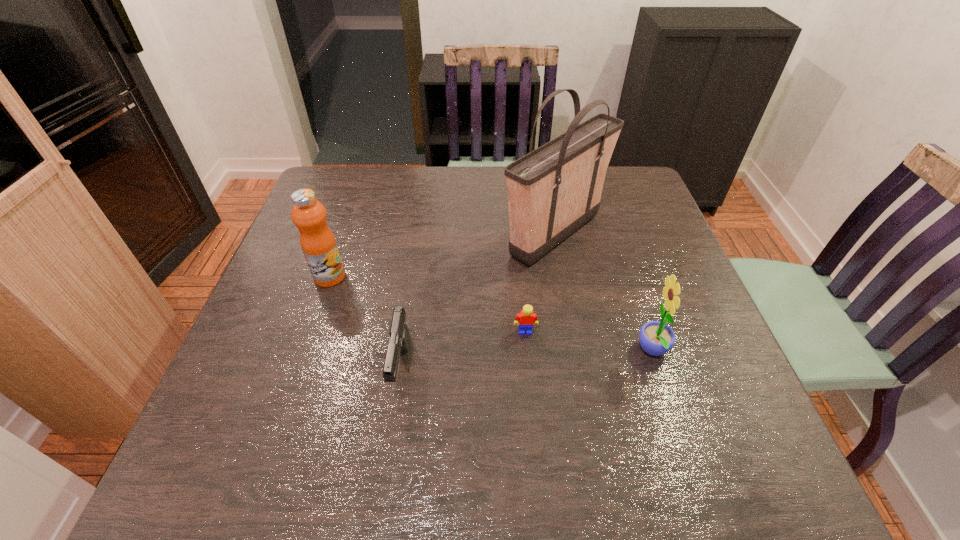
Find the location of `vacant space located on the front-facing side of the third tallest object`. vacant space located on the front-facing side of the third tallest object is located at coordinates (556, 351).

The image size is (960, 540). I want to click on free space located 0.100m aim along the barrel of the fourth object from right to left, so click(389, 456).

At what (x,y) coordinates should I click in order to perform the action: click on free space located on the front-facing side of the shortest object. Please return your answer as a coordinate pair (x, y). Image resolution: width=960 pixels, height=540 pixels. Looking at the image, I should click on (528, 362).

Where is `object located in the far edge section of the desktop`? object located in the far edge section of the desktop is located at coordinates (555, 189).

Identify the location of object present at the left edge. This screenshot has height=540, width=960. (318, 243).

Find the location of a particular element. shopping bag that is positioned at the right edge is located at coordinates tap(555, 189).

This screenshot has height=540, width=960. In order to click on sunflower present at the right edge in this screenshot , I will do `click(656, 338)`.

Image resolution: width=960 pixels, height=540 pixels. Identify the location of object present at the far right corner. (555, 189).

You are a GUI agent. You are given a task and a screenshot of the screen. Output one action in this format:
    pyautogui.click(x=<x>, y=<y>)
    Task: Click on the vacant space at the far edge of the desktop
    This screenshot has height=540, width=960.
    Given the screenshot: What is the action you would take?
    pyautogui.click(x=475, y=179)

What are the coordinates of `vacant space at the near edge` in the screenshot? It's located at (419, 451).